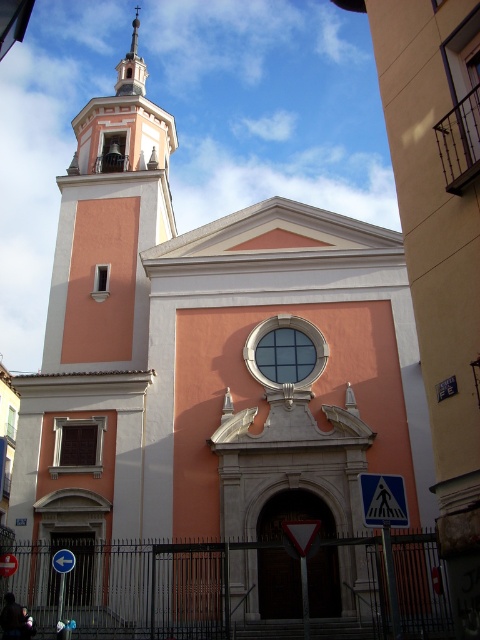
Can you confirm if smooth pink tower at upper left is smaller than smooth white spire at upper center?

Incorrect, smooth pink tower at upper left is not smaller in size than smooth white spire at upper center.

Who is more forward, [139,97] or [142,61]?

Point [139,97] is in front.

What are the coordinates of `smooth pink tower at upper left` in the screenshot? It's located at (109, 221).